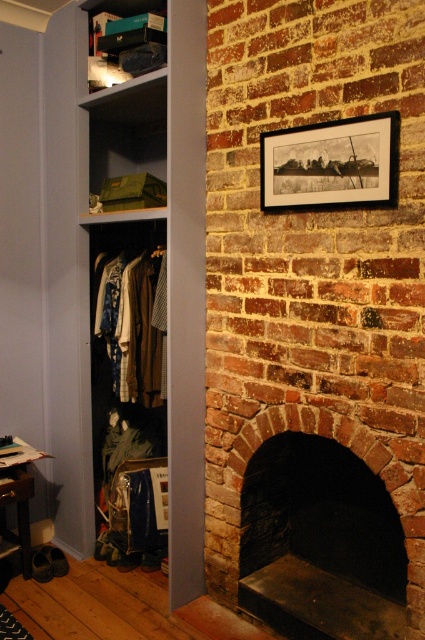
Is black matte picture frame at upper center above matte brown coat at left?

Correct, black matte picture frame at upper center is located above matte brown coat at left.

Is black matte picture frame at upper center to the right of matte brown coat at left from the viewer's perspective?

Correct, you'll find black matte picture frame at upper center to the right of matte brown coat at left.

Who is more forward, (x=306, y=161) or (x=136, y=280)?

Point (x=306, y=161)

This screenshot has height=640, width=425. What are the coordinates of `black matte picture frame at upper center` in the screenshot? It's located at (331, 163).

Does matte gray bookshelf at center have a lesser width compared to matte black shoebox at upper left?

No.

Between point (138, 224) and point (98, 49), which one is positioned in front?

Positioned in front is point (98, 49).

The height and width of the screenshot is (640, 425). I want to click on matte gray bookshelf at center, so click(x=127, y=275).

Can you confirm if matte gray bookshelf at center is bigger than brick fireplace at center?

Correct, matte gray bookshelf at center is larger in size than brick fireplace at center.

Is matte gray bookshelf at center taller than brick fireplace at center?

Yes, matte gray bookshelf at center is taller than brick fireplace at center.

Does point (197, 579) come in front of point (218, 570)?

No, it is not.

I want to click on matte gray bookshelf at center, so [x=127, y=275].